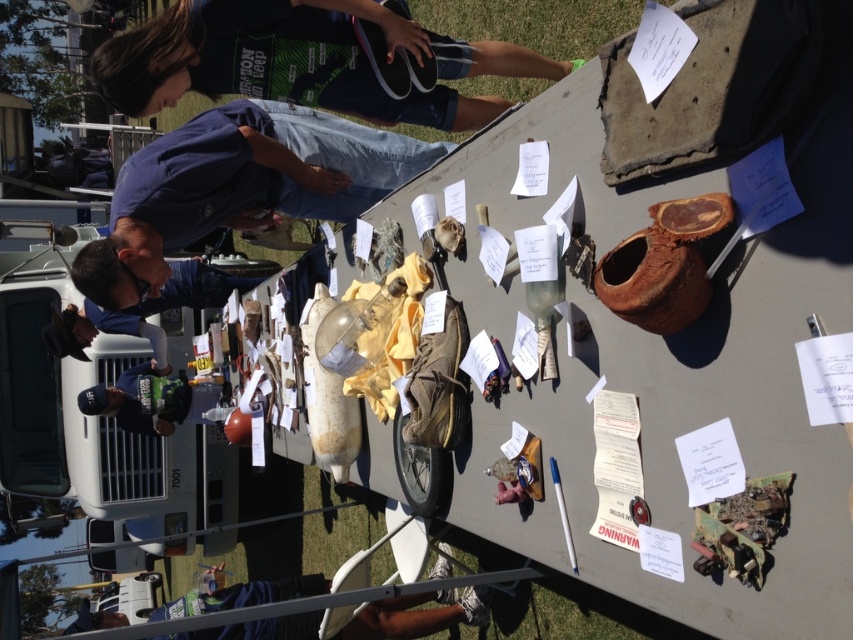
Looking at this image, you are standing in front of a table at a swap meet. You see the blue denim jeans at upper center and the blue fabric shirt at lower left. Which item is positioned closer to you?

The blue denim jeans at upper center are closer to the viewer than the blue fabric shirt at lower left.

You are standing at the edge of the table looking towards the dark blue shirt at upper left and the blue denim jeans at upper center. Which object is positioned farther to the left?

The blue denim jeans at upper center are positioned farther to the left because the dark blue shirt at upper left is to the right of it.

You are organizing a clothing swap event and have limited space on the table. You need to decide which item to place first between the dark blue shirt at upper left and the blue denim jeans at upper center. Based on their sizes, which one should you place first to maximize space efficiency?

The dark blue shirt at upper left has a larger width than the blue denim jeans at upper center. To maximize space efficiency, you should place the larger item first, so start with the dark blue shirt at upper left.